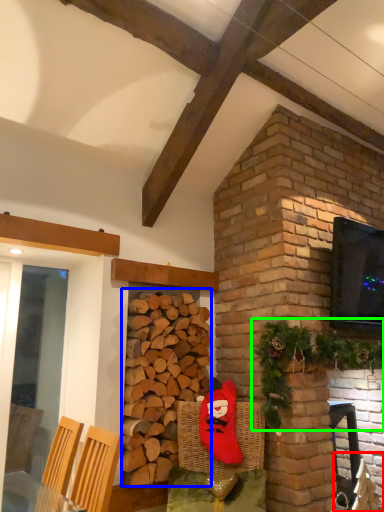
Question: Considering the real-world distances, which object is farthest from armchair (highlighted by a red box)? brickwork (highlighted by a blue box) or christmas decoration (highlighted by a green box)?

Choices:
 (A) brickwork
 (B) christmas decoration

Answer: (A)